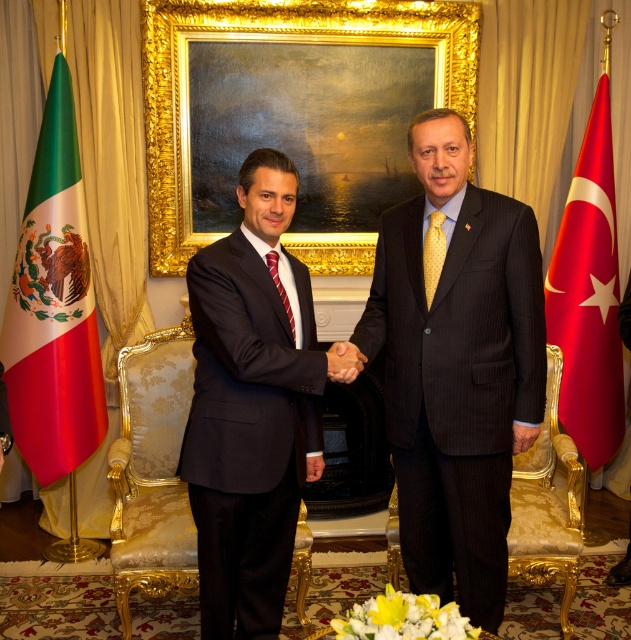
You are a photographer capturing a formal handshake between two diplomats. You need to ensure that the matte black hand at center and the red striped tie at center are clearly visible in the photo. Given that your camera has a minimum focus distance of 10 inches, will you be able to capture both objects in focus without moving closer?

The distance between the matte black hand at center and the red striped tie at center is 8.71 inches, which is less than the camera minimum focus distance of 10 inches. Therefore, the camera cannot focus on both objects simultaneously without moving closer.

You are a photographer at a diplomatic event and need to capture a closeup of the black suit at center and the yellow dotted tie at center. If your camera can only focus on objects wider than 30 cm, will both items be in focus?

The black suit at center is wider than the yellow dotted tie at center. Since the camera focuses on objects wider than 30 cm, the black suit at center will be in focus. However, the yellow dotted tie at center may not be in focus if its width is less than 30 cm. The description does not provide the exact width of the yellow dotted tie at center, so we cannot confirm its focus status.